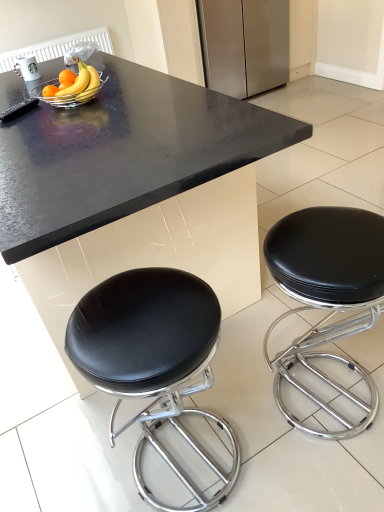
What do you see at coordinates (327, 294) in the screenshot? The width and height of the screenshot is (384, 512). I see `black leather stool at lower right, the 2th stool in the left-to-right sequence` at bounding box center [327, 294].

The image size is (384, 512). What do you see at coordinates (136, 190) in the screenshot?
I see `black granite table at center` at bounding box center [136, 190].

At what (x,y) coordinates should I click in order to perform the action: click on metallic silver bowl at upper center. Please return your answer as a coordinate pair (x, y). Looking at the image, I should click on (67, 96).

From a real-world perspective, which is physically below, yellow matte bananas at upper left, placed as the 1th banana when sorted from front to back, or black granite table at center?

black granite table at center.

Who is shorter, yellow matte bananas at upper left, placed as the 1th banana when sorted from front to back, or black granite table at center?

yellow matte bananas at upper left, placed as the 1th banana when sorted from front to back, is shorter.

Is yellow matte bananas at upper left, placed as the 1th banana when sorted from front to back, bigger than black granite table at center?

Actually, yellow matte bananas at upper left, placed as the 1th banana when sorted from front to back, might be smaller than black granite table at center.

Choose the correct answer: Is yellow matte bananas at upper left, the 2th banana when ordered from back to front, inside black granite table at center or outside it?

yellow matte bananas at upper left, the 2th banana when ordered from back to front, is located beyond the bounds of black granite table at center.

Would you say yellow matte banana at center, marked as the second banana in a front-to-back arrangement, is part of black leather stool at lower right, the 2th stool positioned from the right,'s contents?

No, yellow matte banana at center, marked as the second banana in a front-to-back arrangement, is not surrounded by black leather stool at lower right, the 2th stool positioned from the right.

Considering the sizes of black leather stool at lower right, the 2th stool positioned from the right, and yellow matte banana at center, marked as the second banana in a front-to-back arrangement, in the image, is black leather stool at lower right, the 2th stool positioned from the right, bigger or smaller than yellow matte banana at center, marked as the second banana in a front-to-back arrangement,?

Clearly, black leather stool at lower right, the 2th stool positioned from the right, is larger in size than yellow matte banana at center, marked as the second banana in a front-to-back arrangement.

Locate an element on the screen. The width and height of the screenshot is (384, 512). the 2nd banana to the left when counting from the black leather stool at lower right, the 1th stool viewed from the left is located at coordinates (77, 82).

How different are the orientations of black leather stool at lower right, the 2th stool positioned from the right, and yellow matte banana at center, positioned as the 1th banana in back-to-front order, in degrees?

The angle between the facing direction of black leather stool at lower right, the 2th stool positioned from the right, and the facing direction of yellow matte banana at center, positioned as the 1th banana in back-to-front order, is 91.6 degrees.

Is point (60, 99) closer or farther from the camera than point (333, 277)?

Point (60, 99) appears to be farther away from the viewer than point (333, 277).

Is metallic silver bowl at upper center in front of black leather stool at lower right, acting as the first stool starting from the right?

That is False.

Is black leather stool at lower right, the 2th stool in the left-to-right sequence, a part of metallic silver bowl at upper center?

No, black leather stool at lower right, the 2th stool in the left-to-right sequence, is not surrounded by metallic silver bowl at upper center.

Which of these two, metallic silver bowl at upper center or black leather stool at lower right, the 2th stool in the left-to-right sequence, is smaller?

metallic silver bowl at upper center is smaller.

In terms of size, does black leather stool at lower right, the 2th stool positioned from the right, appear bigger or smaller than yellow matte bananas at upper left, the 2th banana when ordered from back to front?

Considering their sizes, black leather stool at lower right, the 2th stool positioned from the right, takes up more space than yellow matte bananas at upper left, the 2th banana when ordered from back to front.

Which is more to the left, black leather stool at lower right, the 2th stool positioned from the right, or yellow matte bananas at upper left, placed as the 1th banana when sorted from front to back?

From the viewer's perspective, yellow matte bananas at upper left, placed as the 1th banana when sorted from front to back, appears more on the left side.

Is yellow matte bananas at upper left, the 2th banana when ordered from back to front, located within black leather stool at lower right, the 1th stool viewed from the left?

Actually, yellow matte bananas at upper left, the 2th banana when ordered from back to front, is outside black leather stool at lower right, the 1th stool viewed from the left.

From the image's perspective, is black leather stool at lower right, the 1th stool viewed from the left, located above or below yellow matte bananas at upper left, the 2th banana when ordered from back to front?

black leather stool at lower right, the 1th stool viewed from the left, is below yellow matte bananas at upper left, the 2th banana when ordered from back to front.

Can you confirm if black granite table at center is shorter than yellow matte bananas at upper left, placed as the 1th banana when sorted from front to back?

Incorrect, the height of black granite table at center does not fall short of that of yellow matte bananas at upper left, placed as the 1th banana when sorted from front to back.

Is black granite table at center positioned with its back to yellow matte bananas at upper left, the 2th banana when ordered from back to front?

No, black granite table at center's orientation is not away from yellow matte bananas at upper left, the 2th banana when ordered from back to front.

In terms of size, does black granite table at center appear bigger or smaller than yellow matte bananas at upper left, the 2th banana when ordered from back to front?

Clearly, black granite table at center is larger in size than yellow matte bananas at upper left, the 2th banana when ordered from back to front.

Which of these two, black granite table at center or yellow matte bananas at upper left, the 2th banana when ordered from back to front, is thinner?

yellow matte bananas at upper left, the 2th banana when ordered from back to front.

In the scene shown: From a real-world perspective, between yellow matte bananas at upper left, the 2th banana when ordered from back to front, and black leather stool at lower right, the 1th stool viewed from the left, who is vertically higher?

yellow matte bananas at upper left, the 2th banana when ordered from back to front, from a real-world perspective.

Where is `the 2nd banana above the black leather stool at lower right, the 1th stool viewed from the left (from a real-world perspective)`? the 2nd banana above the black leather stool at lower right, the 1th stool viewed from the left (from a real-world perspective) is located at coordinates (75, 86).

Considering their positions, is yellow matte bananas at upper left, placed as the 1th banana when sorted from front to back, located in front of or behind black leather stool at lower right, the 1th stool viewed from the left?

In the image, yellow matte bananas at upper left, placed as the 1th banana when sorted from front to back, appears behind black leather stool at lower right, the 1th stool viewed from the left.

Does yellow matte bananas at upper left, the 2th banana when ordered from back to front, turn towards black leather stool at lower right, the 2th stool positioned from the right?

No, yellow matte bananas at upper left, the 2th banana when ordered from back to front, does not turn towards black leather stool at lower right, the 2th stool positioned from the right.

What's the angular difference between yellow matte bananas at upper left, placed as the 1th banana when sorted from front to back, and metallic silver bowl at upper center's facing directions?

The angular difference between yellow matte bananas at upper left, placed as the 1th banana when sorted from front to back, and metallic silver bowl at upper center is 0.285 degrees.

Choose the correct answer: Is yellow matte bananas at upper left, the 2th banana when ordered from back to front, inside metallic silver bowl at upper center or outside it?

yellow matte bananas at upper left, the 2th banana when ordered from back to front, lies outside metallic silver bowl at upper center.

From a real-world perspective, which object stands above the other?

yellow matte bananas at upper left, placed as the 1th banana when sorted from front to back.

In terms of width, does yellow matte bananas at upper left, placed as the 1th banana when sorted from front to back, look wider or thinner when compared to metallic silver bowl at upper center?

yellow matte bananas at upper left, placed as the 1th banana when sorted from front to back, is thinner than metallic silver bowl at upper center.

Image resolution: width=384 pixels, height=512 pixels. Identify the location of the 1st banana to the left of the black granite table at center, starting your count from the anchor. (75, 86).

There is a yellow matte banana at center, marked as the second banana in a front-to-back arrangement. Identify the location of the 1st stool below it (from a real-world perspective). (153, 360).

Looking at the image, which one is located further to metallic silver bowl at upper center, black granite table at center or black leather stool at lower right, the 1th stool viewed from the left?

The object further to metallic silver bowl at upper center is black leather stool at lower right, the 1th stool viewed from the left.

Estimate the real-world distances between objects in this image. Which object is closer to black leather stool at lower right, the 1th stool viewed from the left, metallic silver bowl at upper center or black granite table at center?

black granite table at center is positioned closer to the anchor black leather stool at lower right, the 1th stool viewed from the left.

Estimate the real-world distances between objects in this image. Which object is further from black leather stool at lower right, acting as the first stool starting from the right, black leather stool at lower right, the 1th stool viewed from the left, or stainless steel refrigerator at upper center?

stainless steel refrigerator at upper center is further to black leather stool at lower right, acting as the first stool starting from the right.

Based on their spatial positions, is black leather stool at lower right, the 2th stool in the left-to-right sequence, or black leather stool at lower right, the 1th stool viewed from the left, closer to yellow matte bananas at upper left, the 2th banana when ordered from back to front?

Among the two, black leather stool at lower right, the 1th stool viewed from the left, is located nearer to yellow matte bananas at upper left, the 2th banana when ordered from back to front.

Based on their spatial positions, is black leather stool at lower right, acting as the first stool starting from the right, or yellow matte banana at center, marked as the second banana in a front-to-back arrangement, closer to stainless steel refrigerator at upper center?

yellow matte banana at center, marked as the second banana in a front-to-back arrangement.

From the image, which object appears to be nearer to yellow matte bananas at upper left, placed as the 1th banana when sorted from front to back, metallic silver bowl at upper center or stainless steel refrigerator at upper center?

metallic silver bowl at upper center is positioned closer to the anchor yellow matte bananas at upper left, placed as the 1th banana when sorted from front to back.

From the image, which object appears to be nearer to metallic silver bowl at upper center, black leather stool at lower right, the 2th stool positioned from the right, or yellow matte bananas at upper left, the 2th banana when ordered from back to front?

yellow matte bananas at upper left, the 2th banana when ordered from back to front, lies closer to metallic silver bowl at upper center than the other object.

Based on their spatial positions, is black leather stool at lower right, the 2th stool positioned from the right, or black leather stool at lower right, acting as the first stool starting from the right, closer to stainless steel refrigerator at upper center?

black leather stool at lower right, acting as the first stool starting from the right, lies closer to stainless steel refrigerator at upper center than the other object.

Identify the location of banana between metallic silver bowl at upper center and stainless steel refrigerator at upper center from front to back. (77, 82).

Identify the location of bowl positioned between black granite table at center and stainless steel refrigerator at upper center from near to far. (67, 96).

Locate an element on the screen. The height and width of the screenshot is (512, 384). bowl between yellow matte bananas at upper left, the 2th banana when ordered from back to front, and black leather stool at lower right, the 2th stool positioned from the right, in the up-down direction is located at coordinates (67, 96).

Where is `table between yellow matte bananas at upper left, the 2th banana when ordered from back to front, and black leather stool at lower right, the 1th stool viewed from the left, in the vertical direction`? This screenshot has width=384, height=512. table between yellow matte bananas at upper left, the 2th banana when ordered from back to front, and black leather stool at lower right, the 1th stool viewed from the left, in the vertical direction is located at coordinates (136, 190).